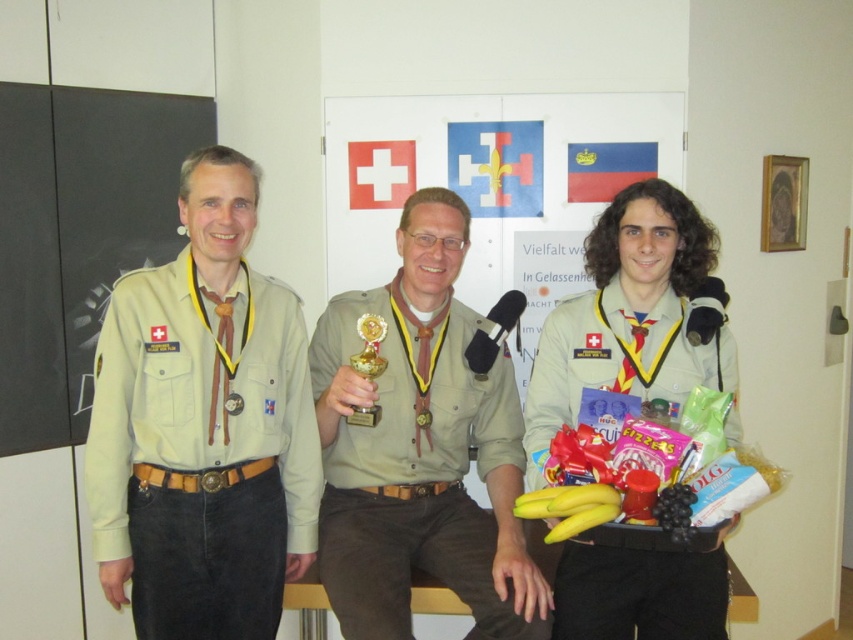
Which is below, matte khaki shirt at center or khaki uniform at center?

matte khaki shirt at center

Between matte khaki shirt at center and khaki uniform at center, which one has more height?

khaki uniform at center

Where is `matte khaki shirt at center`? matte khaki shirt at center is located at coordinates (421, 449).

Where is `matte khaki shirt at center`? The height and width of the screenshot is (640, 853). matte khaki shirt at center is located at coordinates (421, 449).

Can you confirm if beige uniform at left is thinner than khaki uniform at center?

Indeed, beige uniform at left has a lesser width compared to khaki uniform at center.

The image size is (853, 640). What do you see at coordinates (202, 426) in the screenshot? I see `beige uniform at left` at bounding box center [202, 426].

Where is `beige uniform at left`? This screenshot has width=853, height=640. beige uniform at left is located at coordinates (202, 426).

Can you confirm if matte black bulletin board at left is taller than gold metallic trophy at center?

Yes.

Does matte black bulletin board at left appear under gold metallic trophy at center?

No.

Who is more distant from viewer, (212,124) or (363,408)?

Positioned behind is point (212,124).

I want to click on matte black bulletin board at left, so (x=77, y=236).